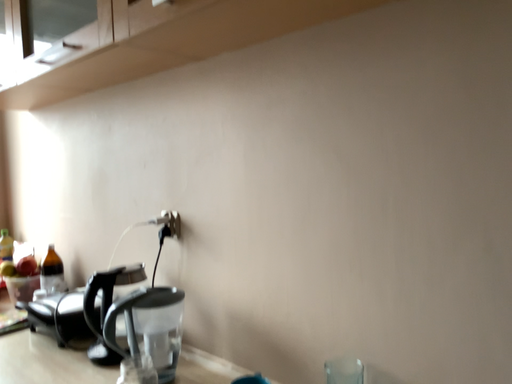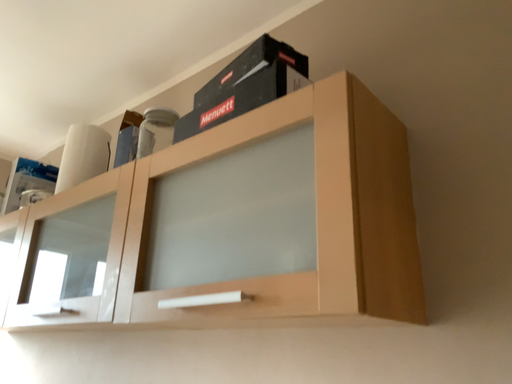
Question: How did the camera likely rotate when shooting the video?

Choices:
 (A) rotated upward
 (B) rotated downward

Answer: (A)